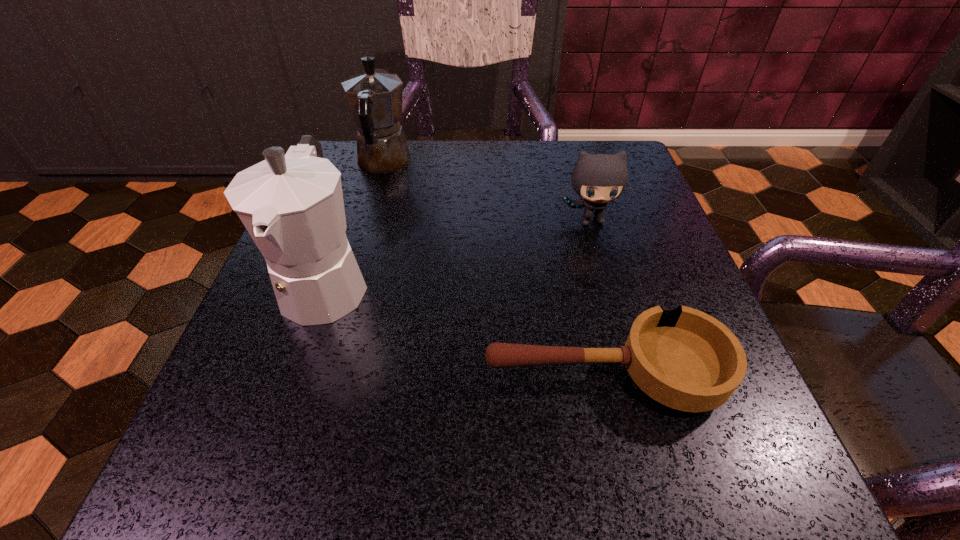
At what (x,y) coordinates should I click in order to perform the action: click on the nearer coffeepot. Please return your answer as a coordinate pair (x, y). Image resolution: width=960 pixels, height=540 pixels. Looking at the image, I should click on (291, 204).

This screenshot has height=540, width=960. In order to click on the farthest object in this screenshot , I will do click(375, 97).

At what (x,y) coordinates should I click in order to perform the action: click on the third tallest object. Please return your answer as a coordinate pair (x, y). The image size is (960, 540). Looking at the image, I should click on (597, 178).

The image size is (960, 540). I want to click on the third nearest object, so pos(597,178).

Where is `the shortest object`? The height and width of the screenshot is (540, 960). the shortest object is located at coordinates (685, 359).

The image size is (960, 540). Find the location of `vacant area situated at the spout of the nearer coffeepot`. vacant area situated at the spout of the nearer coffeepot is located at coordinates (268, 453).

Identify the location of vacant space located on the front-facing side of the second farthest object. (599, 251).

Find the location of a particular element. This screenshot has width=960, height=540. vacant area situated 0.320m with the handle on the side of the saucepan is located at coordinates (257, 375).

In order to click on free space located 0.340m with the handle on the side of the saucepan in this screenshot , I will do `click(244, 375)`.

Where is `vacant space located 0.250m with the handle on the side of the saucepan`? vacant space located 0.250m with the handle on the side of the saucepan is located at coordinates (307, 375).